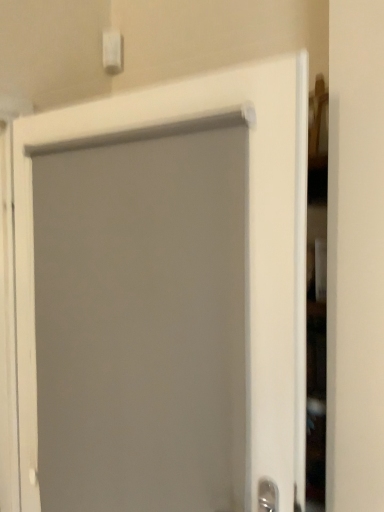
Where is `matte gray door at center`? Image resolution: width=384 pixels, height=512 pixels. matte gray door at center is located at coordinates pos(250,231).

The height and width of the screenshot is (512, 384). Describe the element at coordinates (250, 231) in the screenshot. I see `matte gray door at center` at that location.

Where is `matte gray door at center`? The height and width of the screenshot is (512, 384). matte gray door at center is located at coordinates (250, 231).